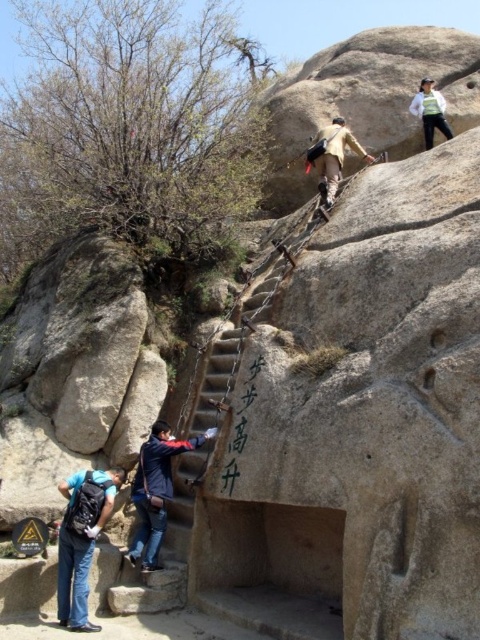
You are a hiker trying to decide whether to place your camping gear on the matte black backpack at lower left or the white matte jacket at upper right. Based on their sizes, which object can hold more items?

The matte black backpack at lower left is taller than the white matte jacket at upper right, so it can hold more items.

You are planning to hike up the mountain trail and need to know if your backpack will be visible from the top. Given the positions of the matte black backpack at lower left and the dark blue jacket at center, which object is lower in the image?

The matte black backpack at lower left is located below the dark blue jacket at center, so it is lower in the image and would likely be visible from the top if positioned accordingly.

You are a hiker planning to carry both the matte black backpack at lower left and the white matte jacket at upper right. Which item can you place first in your backpack to ensure it fits properly?

The matte black backpack at lower left has a larger size compared to the white matte jacket at upper right, so you should place the larger matte black backpack at lower left first to ensure proper fitting.